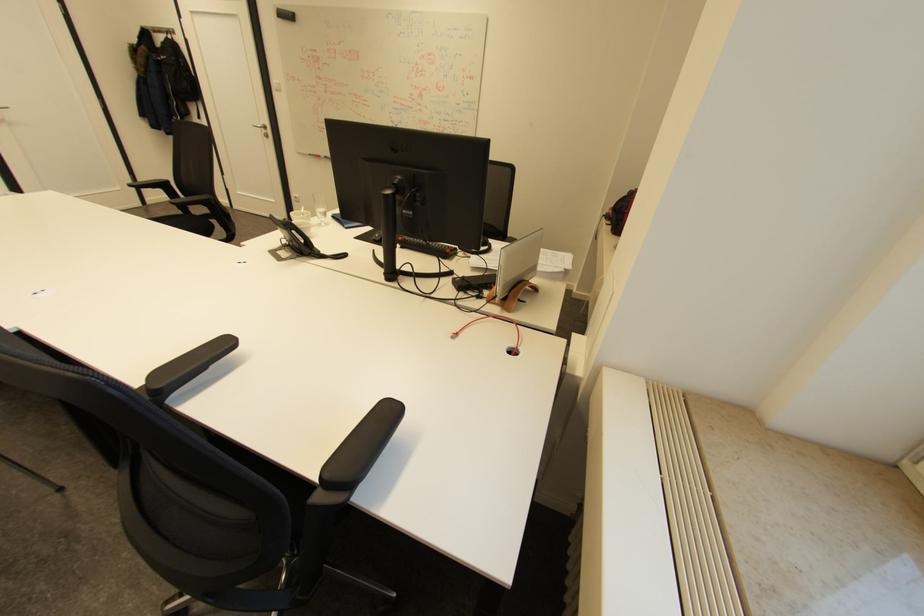
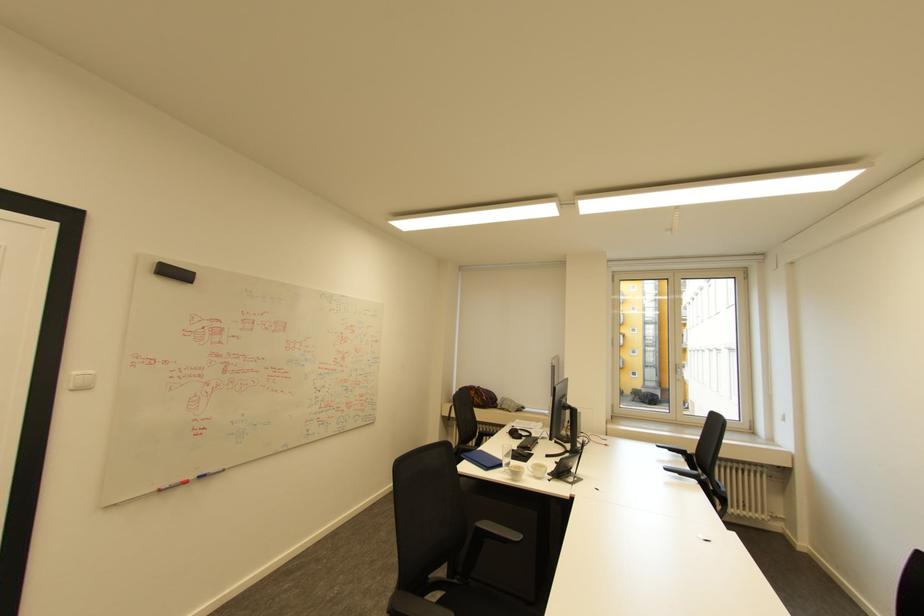
Find the pixel in the second image that matches [333,156] in the first image.

(207, 477)